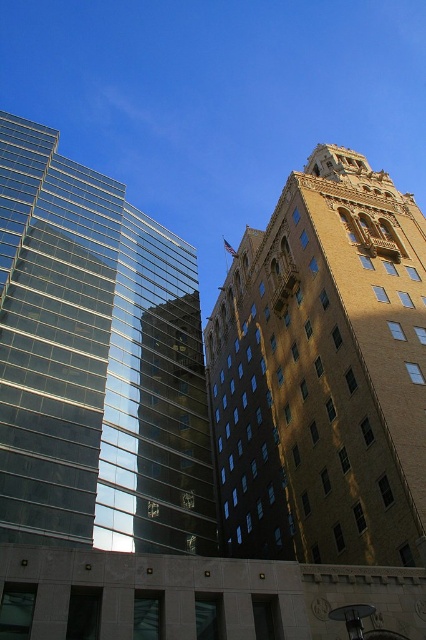
You are standing in front of the two buildings in the image. There are two points marked on the image. One is at coordinate point (408, 346) and the other is at point (48, 145). Which point is closer to you?

Point (408, 346) is closer to the viewer than point (48, 145).

You are an architect analyzing the spatial relationship between the golden stone tower at upper right and the transparent glass building at left. Based on their positions, which one appears nearer to the observer?

The golden stone tower at upper right appears closer to the observer than the transparent glass building at left because it is positioned closer to the viewer.

You are an architect analyzing the spatial relationship between the golden stone tower at upper right and the transparent glass building at left. Which building is positioned lower in the image?

The golden stone tower at upper right is located below the transparent glass building at left, so it is positioned lower in the image.